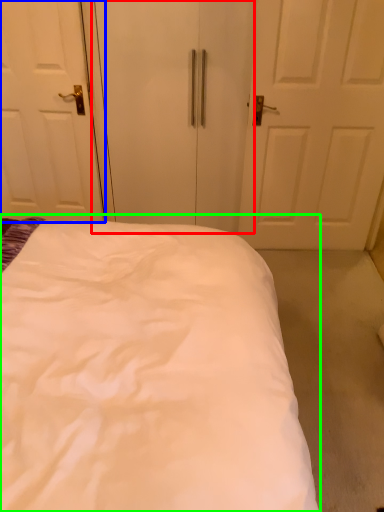
Question: Which object is the farthest from screen door (highlighted by a red box)? Choose among these: door (highlighted by a blue box) or bed (highlighted by a green box).

Choices:
 (A) door
 (B) bed

Answer: (B)